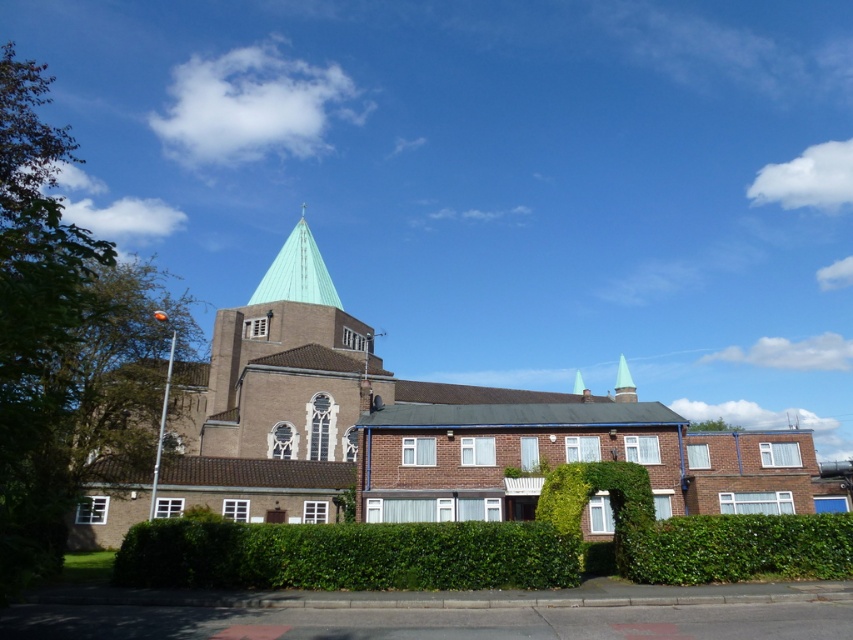
The width and height of the screenshot is (853, 640). Describe the element at coordinates (297, 273) in the screenshot. I see `green metallic spire at upper center` at that location.

You are a GUI agent. You are given a task and a screenshot of the screen. Output one action in this format:
    pyautogui.click(x=<x>, y=<y>)
    Task: Click on the green metallic spire at upper center
    The height and width of the screenshot is (640, 853).
    Given the screenshot: What is the action you would take?
    pyautogui.click(x=297, y=273)

What do you see at coordinates (426, 435) in the screenshot?
I see `brown brick church at center` at bounding box center [426, 435].

Measure the distance from brown brick church at center to green metallic spire at upper center.

brown brick church at center is 111.16 feet from green metallic spire at upper center.

Describe the element at coordinates (426, 435) in the screenshot. The height and width of the screenshot is (640, 853). I see `brown brick church at center` at that location.

The width and height of the screenshot is (853, 640). What are the coordinates of `brown brick church at center` in the screenshot? It's located at click(426, 435).

Is brown brick church at center bigger than green glass spire at upper center?

Indeed, brown brick church at center has a larger size compared to green glass spire at upper center.

Is point (440, 417) more distant than point (622, 364)?

No, it is not.

What are the coordinates of `brown brick church at center` in the screenshot? It's located at coord(426,435).